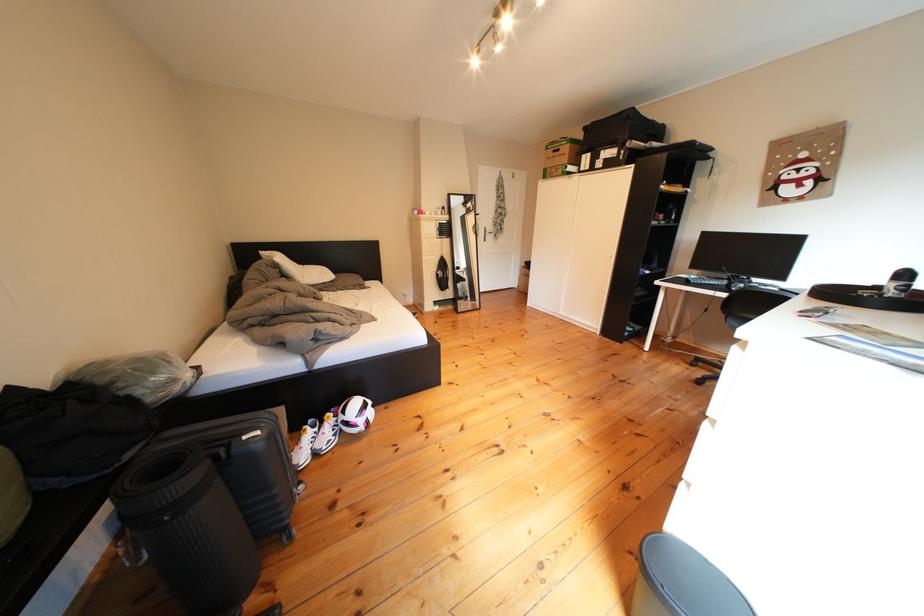
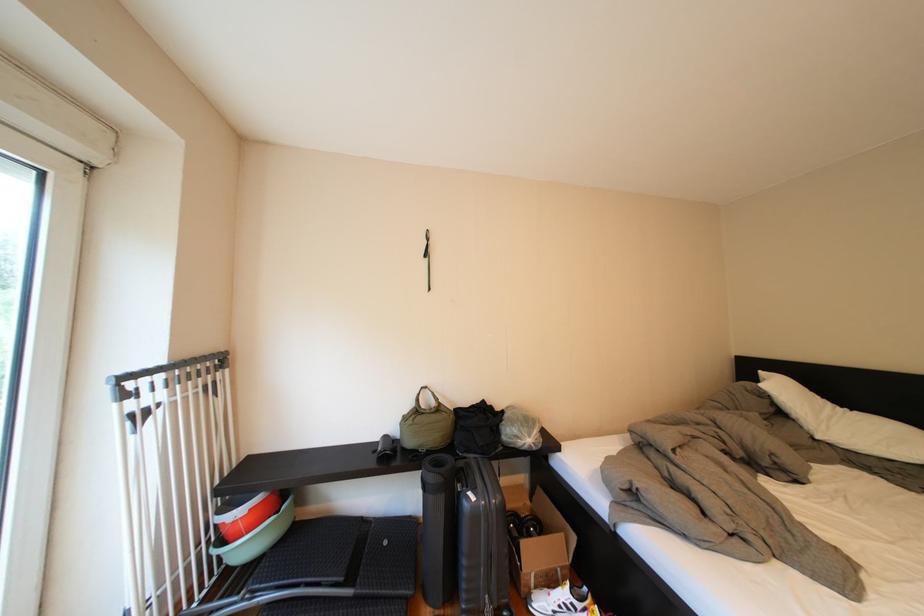
Locate, in the second image, the point that corresponds to point (317, 463) in the first image.

(554, 609)